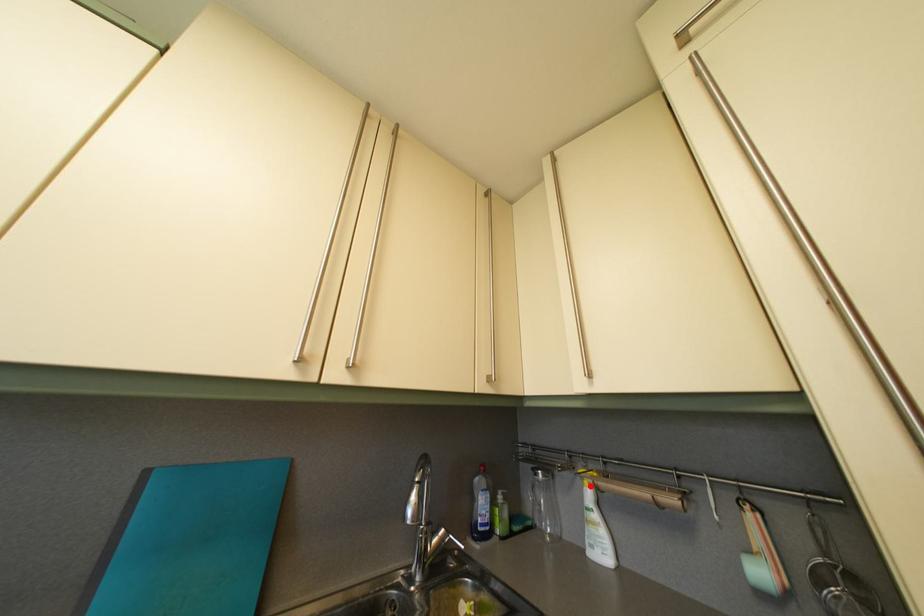
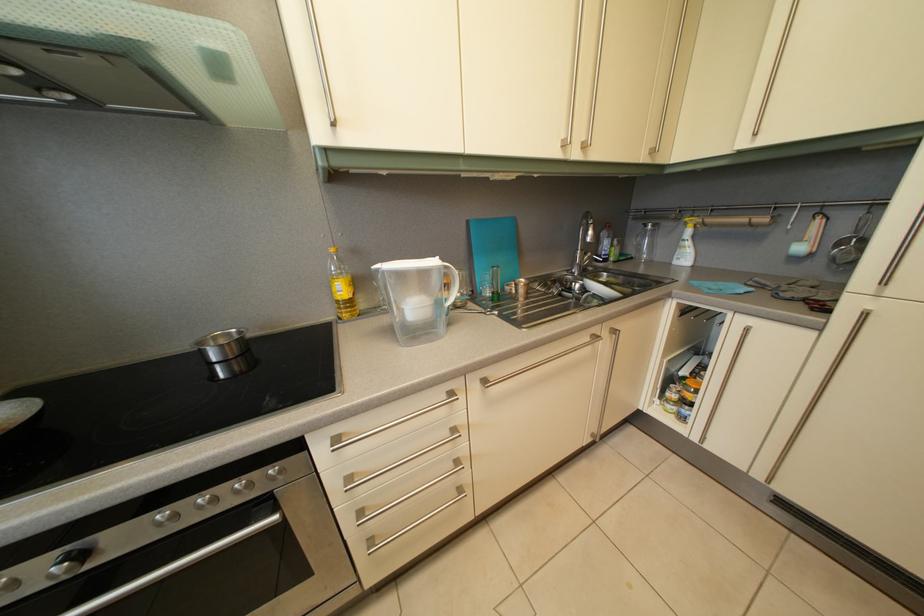
Find the pixel in the second image that matches the highlighted location in the first image.

(694, 232)